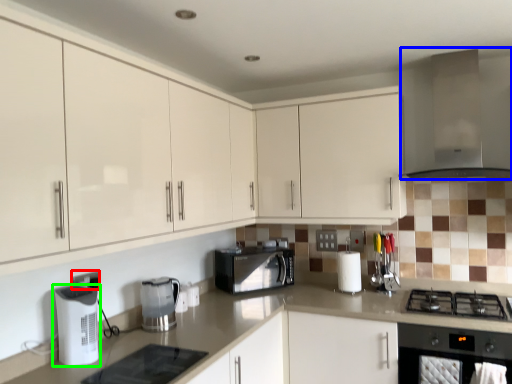
Question: Estimate the real-world distances between objects in this image. Which object is closer to electric outlet (highlighted by a red box), exhaust hood (highlighted by a blue box) or kitchen appliance (highlighted by a green box)?

Choices:
 (A) exhaust hood
 (B) kitchen appliance

Answer: (B)